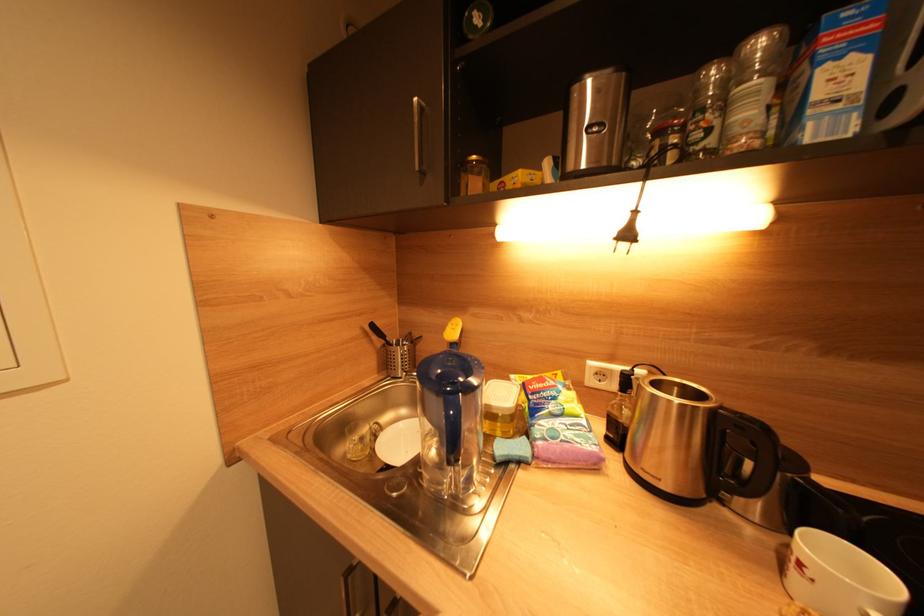
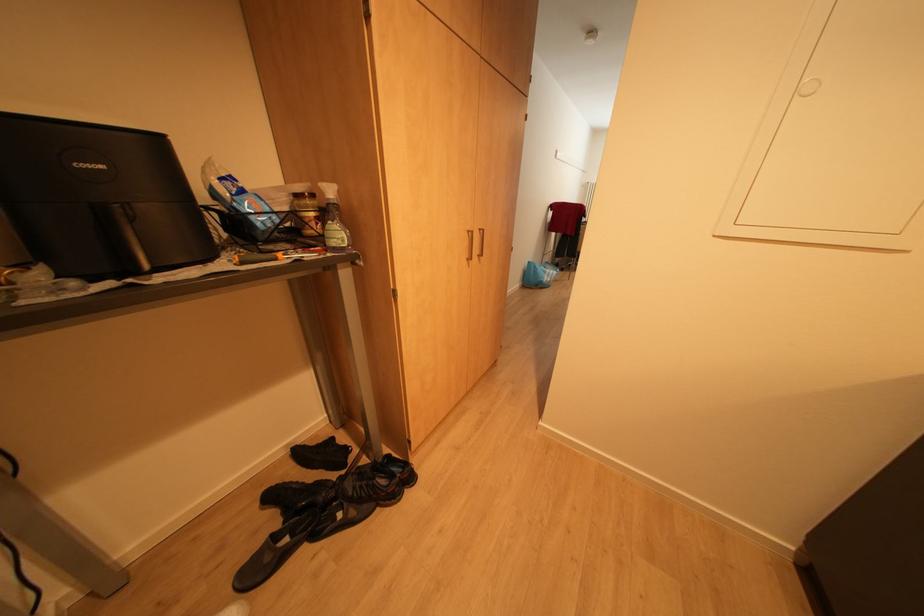
First-person continuous shooting, in which direction is the camera rotating?

The camera's rotation is toward left-down.